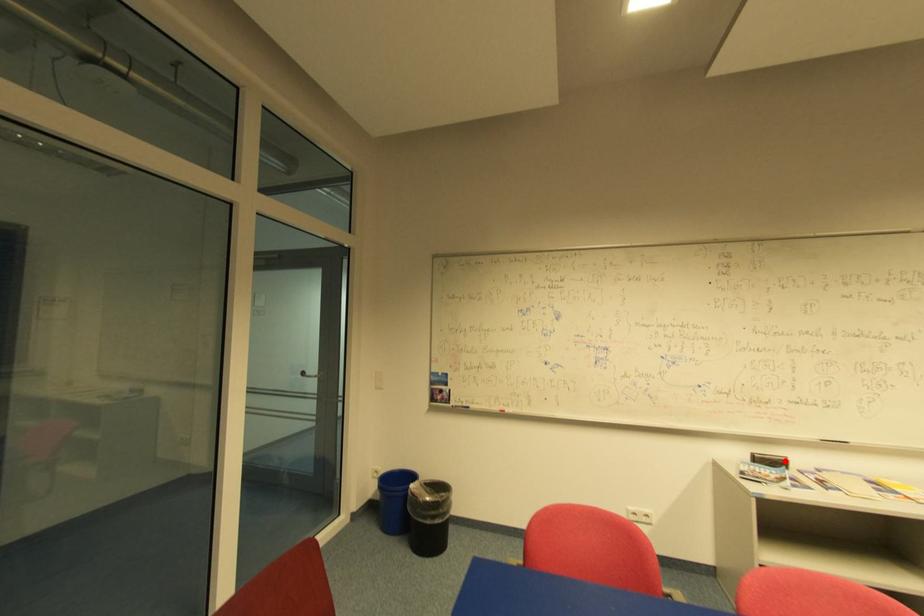
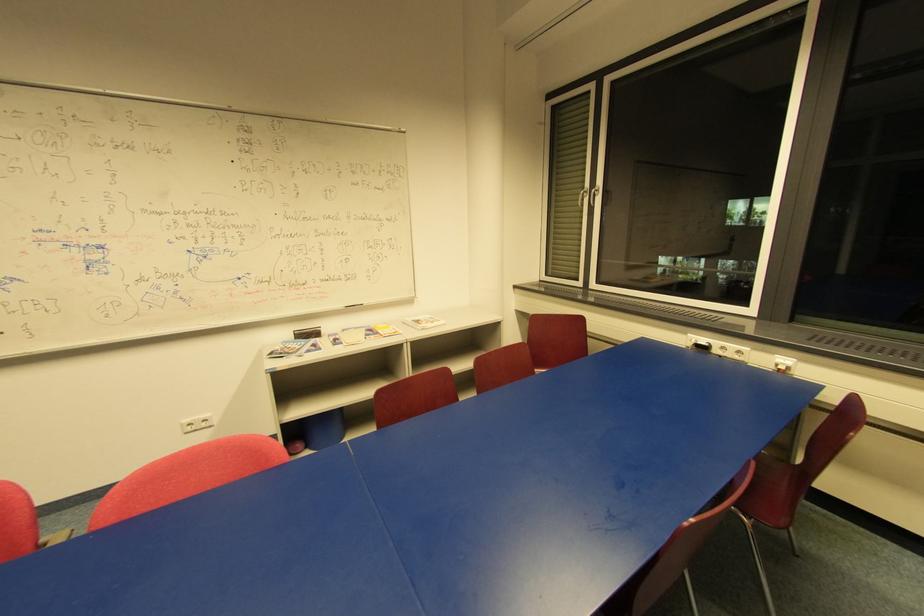
In the second image, find the point that corresponds to the highlighted location in the first image.

(319, 331)